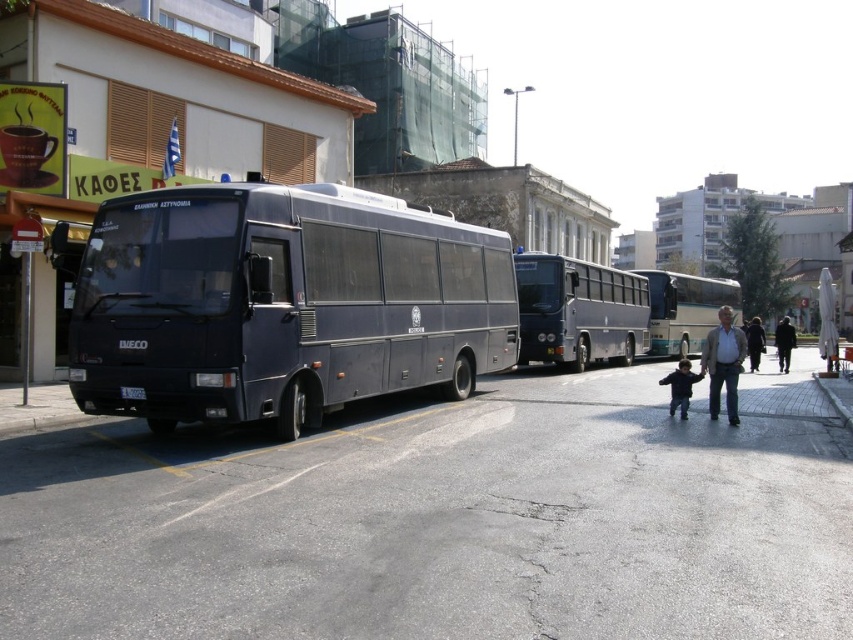
Does metallic silver bus at center have a lesser width compared to dark blue sweater at center?

No, metallic silver bus at center is not thinner than dark blue sweater at center.

Where is `metallic silver bus at center`? metallic silver bus at center is located at coordinates (685, 308).

Between point (683, 323) and point (689, 380), which one is positioned behind?

Positioned behind is point (683, 323).

Find the location of a particular element. The image size is (853, 640). metallic silver bus at center is located at coordinates (685, 308).

Is metallic bus stop at left below dark blue jacket at center?

No.

Between point (9, 374) and point (753, 369), which one is positioned behind?

Point (753, 369)

Find the location of a particular element. The image size is (853, 640). metallic bus stop at left is located at coordinates (33, 285).

Can you confirm if dark blue jacket at center is taller than gray concrete curb at lower right?

Indeed, dark blue jacket at center has a greater height compared to gray concrete curb at lower right.

Between dark blue jacket at center and gray concrete curb at lower right, which one is positioned lower?

Positioned lower is gray concrete curb at lower right.

Is point (751, 332) farther from viewer compared to point (850, 417)?

That is True.

Where is `dark blue jacket at center`? This screenshot has width=853, height=640. dark blue jacket at center is located at coordinates (753, 342).